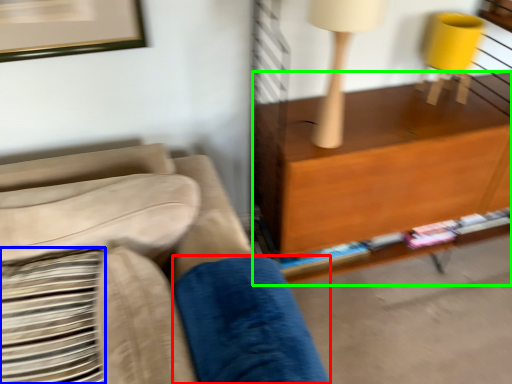
Question: Considering the real-world distances, which object is closest to pillow (highlighted by a red box)? pillow (highlighted by a blue box) or shelf (highlighted by a green box).

Choices:
 (A) pillow
 (B) shelf

Answer: (A)